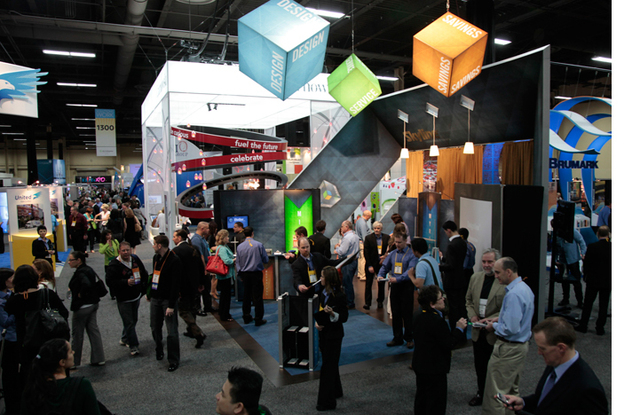
You are a GUI agent. You are given a task and a screenshot of the screen. Output one action in this format:
    pyautogui.click(x=<x>, y=<y>)
    Task: Click on the display
    Image resolution: width=640 pixels, height=415 pixels.
    Given the screenshot: What is the action you would take?
    pyautogui.click(x=262, y=229), pyautogui.click(x=237, y=123), pyautogui.click(x=459, y=130), pyautogui.click(x=572, y=138), pyautogui.click(x=11, y=206)